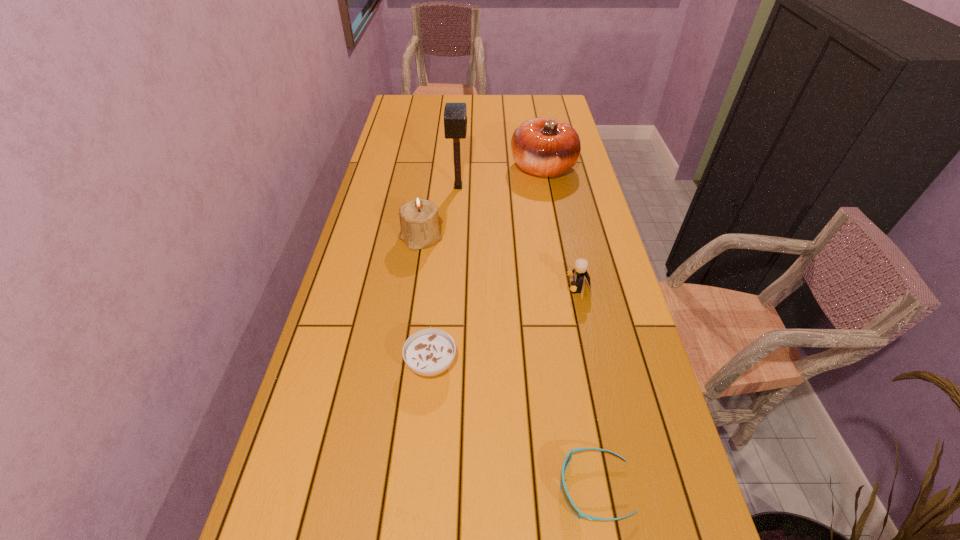
Find the location of a particular element. This screenshot has width=960, height=540. blank region between the third farthest object and the Lego is located at coordinates (499, 263).

Image resolution: width=960 pixels, height=540 pixels. Find the location of `vacant space in between the pumpkin and the mallet`. vacant space in between the pumpkin and the mallet is located at coordinates (501, 178).

Identify the location of free spot between the fifth tallest object and the fourth tallest object. The image size is (960, 540). (505, 326).

The image size is (960, 540). I want to click on free spot between the pumpkin and the Lego, so click(561, 228).

Locate an element on the screen. The image size is (960, 540). free space between the fifth tallest object and the candle_holder is located at coordinates (425, 301).

Locate an element on the screen. This screenshot has height=540, width=960. free spot between the shortest object and the pumpkin is located at coordinates (568, 328).

I want to click on vacant space that's between the second nearest object and the fourth tallest object, so click(505, 326).

Find the location of `object that stands as the fourth closest to the mallet`. object that stands as the fourth closest to the mallet is located at coordinates (428, 352).

I want to click on object that is the third nearest to the soup bowl, so click(x=419, y=222).

What are the coordinates of `vacant space that satisfies the following two spatial constraints: 1. on the front-facing side of the fourth farthest object; 2. on the front side of the fifth tallest object` in the screenshot? It's located at (595, 363).